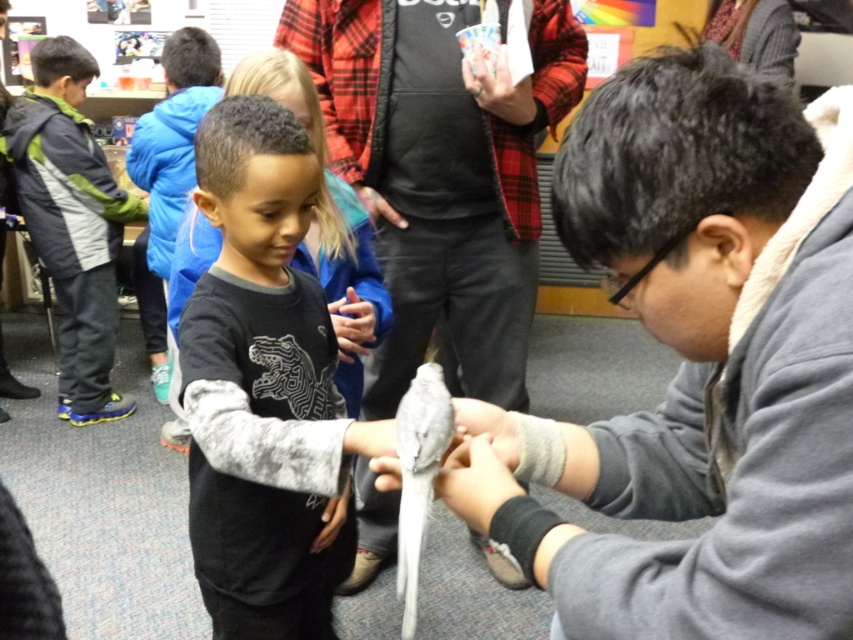
Question: Does gray fleece jacket at left appear on the right side of matte blue glove at center?

Choices:
 (A) no
 (B) yes

Answer: (A)

Question: Does gray fleece sweater at center have a greater width compared to flannel shirt at center?

Choices:
 (A) no
 (B) yes

Answer: (A)

Question: Can you confirm if gray fleece jacket at left is bigger than matte blue glove at center?

Choices:
 (A) yes
 (B) no

Answer: (A)

Question: Which point is closer to the camera?

Choices:
 (A) matte black hand at center
 (B) gray fleece jacket at left
 (C) black fleece sweatshirt at upper center
 (D) matte blue glove at center

Answer: (D)

Question: Which point is farther from the camera taking this photo?

Choices:
 (A) (383, 88)
 (B) (704, 632)

Answer: (A)

Question: Which of the following is the closest to the observer?

Choices:
 (A) matte blue glove at center
 (B) gray fleece jacket at left
 (C) gray fleece sweater at center
 (D) matte black hand at center

Answer: (C)